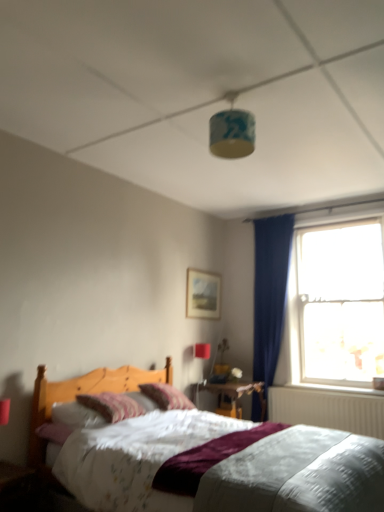
This screenshot has height=512, width=384. Find the location of `striped fabric pillow at center, which is the 1th pillow from front to back`. striped fabric pillow at center, which is the 1th pillow from front to back is located at coordinates (112, 405).

In order to face striped fabric pillow at center, the second pillow when ordered from back to front, should I rotate leftwards or rightwards?

Turn left approximately 10.438 degrees to face it.

The width and height of the screenshot is (384, 512). Describe the element at coordinates (201, 358) in the screenshot. I see `matte white lampshade at upper center, the second light fixture viewed from the top` at that location.

Where is `transparent glass window at right`? The height and width of the screenshot is (512, 384). transparent glass window at right is located at coordinates tap(335, 298).

What do you see at coordinates (166, 396) in the screenshot? I see `velvet purple pillow at center, the 2th pillow in the front-to-back sequence` at bounding box center [166, 396].

You are a GUI agent. You are given a task and a screenshot of the screen. Output one action in this format:
    pyautogui.click(x=<x>, y=<y>)
    Task: Click on the blue fabric lampshade at upper center, the second light fixture when ordered from back to front
    Image resolution: width=384 pixels, height=512 pixels.
    Given the screenshot: What is the action you would take?
    pyautogui.click(x=232, y=131)

Where is `striped fabric pillow at center, which is the 1th pillow from front to back`? The image size is (384, 512). striped fabric pillow at center, which is the 1th pillow from front to back is located at coordinates (112, 405).

From the picture: From a real-world perspective, is striped fabric pillow at center, the second pillow when ordered from back to front, positioned under wooden nightstand at center based on gravity?

No, from a real-world perspective, striped fabric pillow at center, the second pillow when ordered from back to front, is not under wooden nightstand at center.

Based on the photo, which is more to the left, striped fabric pillow at center, which is the 1th pillow from front to back, or wooden nightstand at center?

striped fabric pillow at center, which is the 1th pillow from front to back.

In terms of width, does striped fabric pillow at center, the second pillow when ordered from back to front, look wider or thinner when compared to wooden nightstand at center?

Considering their sizes, striped fabric pillow at center, the second pillow when ordered from back to front, looks slimmer than wooden nightstand at center.

Is white glossy window sill at lower right aimed at transparent glass window at right?

Yes, white glossy window sill at lower right is oriented towards transparent glass window at right.

How many degrees apart are the facing directions of white glossy window sill at lower right and transparent glass window at right?

0.00145 degrees separate the facing orientations of white glossy window sill at lower right and transparent glass window at right.

How much distance is there between white glossy window sill at lower right and transparent glass window at right?

The distance of white glossy window sill at lower right from transparent glass window at right is 38.66 inches.

In the image, is white glossy window sill at lower right positioned in front of or behind transparent glass window at right?

Clearly, white glossy window sill at lower right is behind transparent glass window at right.

Considering the relative sizes of velvet purple pillow at center, which is counted as the 1th pillow, starting from the back, and striped fabric pillow at center, the second pillow when ordered from back to front, in the image provided, is velvet purple pillow at center, which is counted as the 1th pillow, starting from the back, shorter than striped fabric pillow at center, the second pillow when ordered from back to front,?

Incorrect, the height of velvet purple pillow at center, which is counted as the 1th pillow, starting from the back, does not fall short of that of striped fabric pillow at center, the second pillow when ordered from back to front.

Locate an element on the screen. pillow that appears on the right of striped fabric pillow at center, the second pillow when ordered from back to front is located at coordinates (166, 396).

Looking at the image, does velvet purple pillow at center, the 2th pillow in the front-to-back sequence, seem bigger or smaller compared to striped fabric pillow at center, which is the 1th pillow from front to back?

velvet purple pillow at center, the 2th pillow in the front-to-back sequence, is bigger than striped fabric pillow at center, which is the 1th pillow from front to back.

Considering the relative positions of velvet purple pillow at center, which is counted as the 1th pillow, starting from the back, and striped fabric pillow at center, the second pillow when ordered from back to front, in the image provided, is velvet purple pillow at center, which is counted as the 1th pillow, starting from the back, to the left of striped fabric pillow at center, the second pillow when ordered from back to front, from the viewer's perspective?

No, velvet purple pillow at center, which is counted as the 1th pillow, starting from the back, is not to the left of striped fabric pillow at center, the second pillow when ordered from back to front.

Looking at this image, is striped fabric pillow at center, the second pillow when ordered from back to front, positioned in front of transparent glass window at right?

Yes.

Between striped fabric pillow at center, the second pillow when ordered from back to front, and transparent glass window at right, which one appears on the left side from the viewer's perspective?

From the viewer's perspective, striped fabric pillow at center, the second pillow when ordered from back to front, appears more on the left side.

Can you confirm if striped fabric pillow at center, which is the 1th pillow from front to back, is smaller than transparent glass window at right?

Yes.

From the image's perspective, which is above, striped fabric pillow at center, which is the 1th pillow from front to back, or transparent glass window at right?

transparent glass window at right, from the image's perspective.

Which is closer, (206, 296) or (120, 396)?

Point (120, 396)

Looking at their sizes, would you say wooden picture frame at upper center is wider or thinner than striped fabric pillow at center, the second pillow when ordered from back to front?

In the image, wooden picture frame at upper center appears to be more narrow than striped fabric pillow at center, the second pillow when ordered from back to front.

Can you confirm if wooden picture frame at upper center is shorter than striped fabric pillow at center, which is the 1th pillow from front to back?

Incorrect, the height of wooden picture frame at upper center does not fall short of that of striped fabric pillow at center, which is the 1th pillow from front to back.

Is wooden picture frame at upper center aimed at striped fabric pillow at center, the second pillow when ordered from back to front?

No, wooden picture frame at upper center is not turned towards striped fabric pillow at center, the second pillow when ordered from back to front.

Considering the positions of objects transparent glass window at right and striped fabric pillow at center, the second pillow when ordered from back to front, in the image provided, who is more to the left, transparent glass window at right or striped fabric pillow at center, the second pillow when ordered from back to front,?

striped fabric pillow at center, the second pillow when ordered from back to front.

Considering the points (351, 378) and (106, 420), which point is behind, point (351, 378) or point (106, 420)?

The point (351, 378) is farther from the camera.

How far apart are transparent glass window at right and striped fabric pillow at center, the second pillow when ordered from back to front?

transparent glass window at right is 2.73 meters away from striped fabric pillow at center, the second pillow when ordered from back to front.

Considering their positions, is transparent glass window at right located in front of or behind striped fabric pillow at center, which is the 1th pillow from front to back?

Visually, transparent glass window at right is located behind striped fabric pillow at center, which is the 1th pillow from front to back.

Considering the relative positions of white glossy window sill at lower right and velvet purple pillow at center, the 2th pillow in the front-to-back sequence, in the image provided, is white glossy window sill at lower right in front of velvet purple pillow at center, the 2th pillow in the front-to-back sequence,?

No, the depth of white glossy window sill at lower right is greater than that of velvet purple pillow at center, the 2th pillow in the front-to-back sequence.

Considering the relative sizes of white glossy window sill at lower right and velvet purple pillow at center, which is counted as the 1th pillow, starting from the back, in the image provided, is white glossy window sill at lower right taller than velvet purple pillow at center, which is counted as the 1th pillow, starting from the back,?

Incorrect, the height of white glossy window sill at lower right is not larger of that of velvet purple pillow at center, which is counted as the 1th pillow, starting from the back.

How many degrees apart are the facing directions of white glossy window sill at lower right and velvet purple pillow at center, which is counted as the 1th pillow, starting from the back?

The angle between the facing direction of white glossy window sill at lower right and the facing direction of velvet purple pillow at center, which is counted as the 1th pillow, starting from the back, is 88.9 degrees.

Looking at this image, between white glossy window sill at lower right and velvet purple pillow at center, which is counted as the 1th pillow, starting from the back, which one appears on the right side from the viewer's perspective?

white glossy window sill at lower right is more to the right.

At what (x,y) coordinates should I click in order to perform the action: click on nightstand located below the striped fabric pillow at center, the second pillow when ordered from back to front (from the image's perspective). Please return your answer as a coordinate pair (x, y). The image size is (384, 512). Looking at the image, I should click on (237, 392).

Find the location of `window to the right of white glossy window sill at lower right`. window to the right of white glossy window sill at lower right is located at coordinates (335, 298).

Looking at the image, which one is located further to matte white lampshade at upper center, positioned as the first light fixture in back-to-front order, transparent glass window at right or striped fabric pillow at center, the second pillow when ordered from back to front?

Among the two, striped fabric pillow at center, the second pillow when ordered from back to front, is located further to matte white lampshade at upper center, positioned as the first light fixture in back-to-front order.

Which object lies nearer to the anchor point wooden picture frame at upper center, blue fabric lampshade at upper center, acting as the 1th light fixture starting from the top, or wooden nightstand at center?

Based on the image, wooden nightstand at center appears to be nearer to wooden picture frame at upper center.

In the scene shown: Looking at the image, which one is located further to wooden nightstand at center, transparent glass window at right or velvet purple pillow at center, the 2th pillow in the front-to-back sequence?

transparent glass window at right.

Considering their positions, is velvet purple pillow at center, which is counted as the 1th pillow, starting from the back, positioned closer to blue fabric lampshade at upper center, acting as the 1th light fixture starting from the top, than white glossy window sill at lower right?

velvet purple pillow at center, which is counted as the 1th pillow, starting from the back, is positioned closer to the anchor blue fabric lampshade at upper center, acting as the 1th light fixture starting from the top.

Looking at the image, which one is located further to wooden picture frame at upper center, transparent glass window at right or velvet purple pillow at center, the 2th pillow in the front-to-back sequence?

velvet purple pillow at center, the 2th pillow in the front-to-back sequence, is further to wooden picture frame at upper center.

Estimate the real-world distances between objects in this image. Which object is further from striped fabric pillow at center, the second pillow when ordered from back to front, matte white lampshade at upper center, the 1th light fixture from the bottom, or velvet purple pillow at center, the 2th pillow in the front-to-back sequence?

Among the two, matte white lampshade at upper center, the 1th light fixture from the bottom, is located further to striped fabric pillow at center, the second pillow when ordered from back to front.

From the image, which object appears to be nearer to white glossy window sill at lower right, wooden nightstand at center or velvet purple pillow at center, the 2th pillow in the front-to-back sequence?

Among the two, wooden nightstand at center is located nearer to white glossy window sill at lower right.

Looking at the image, which one is located further to transparent glass window at right, wooden picture frame at upper center or wooden nightstand at center?

wooden picture frame at upper center is further to transparent glass window at right.

You are a GUI agent. You are given a task and a screenshot of the screen. Output one action in this format:
    pyautogui.click(x=<x>, y=<y>)
    Task: Click on the picture frame between striped fabric pillow at center, the second pillow when ordered from back to front, and white glossy window sill at lower right, in the horizontal direction
    The image size is (384, 512).
    Given the screenshot: What is the action you would take?
    pyautogui.click(x=203, y=294)

Find the location of a particular element. This screenshot has width=384, height=512. light fixture between velvet purple pillow at center, which is counted as the 1th pillow, starting from the back, and wooden picture frame at upper center in the front-back direction is located at coordinates (201, 358).

Identify the location of light fixture between blue fabric lampshade at upper center, marked as the 2th light fixture in a bottom-to-top arrangement, and velvet purple pillow at center, the 2th pillow in the front-to-back sequence, in the vertical direction. [201, 358].

Locate an element on the screen. The width and height of the screenshot is (384, 512). picture frame between matte white lampshade at upper center, the 1th light fixture from the bottom, and white glossy window sill at lower right is located at coordinates (203, 294).